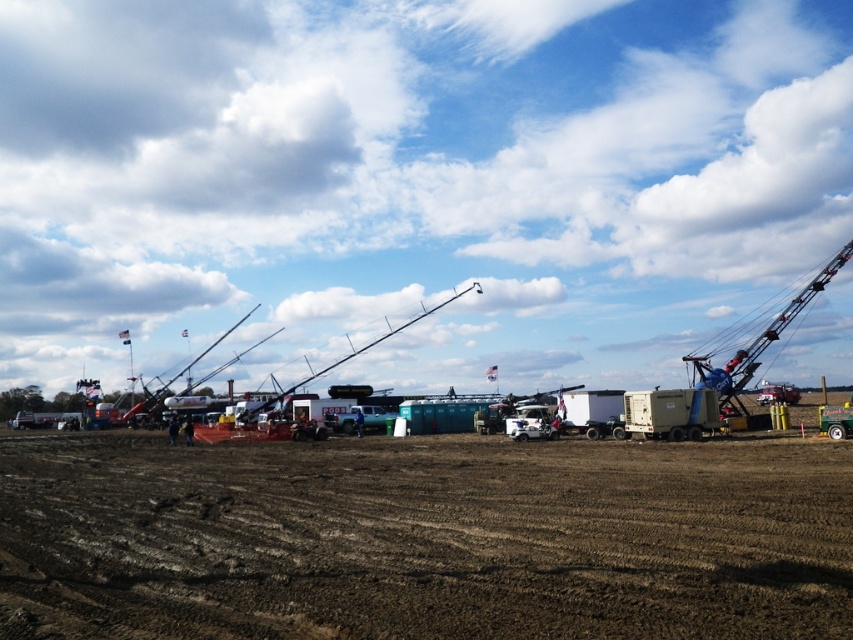
Is brown soil at center thinner than blue metallic crane at right?

Yes.

Which of these two, brown soil at center or blue metallic crane at right, stands taller?

Standing taller between the two is blue metallic crane at right.

Who is more distant from viewer, [201,452] or [723,365]?

Point [723,365]

The height and width of the screenshot is (640, 853). In order to click on brown soil at center in this screenshot , I will do `click(422, 538)`.

Can you confirm if brown soil at center is positioned below beige rubber trailer truck at center right?

Actually, brown soil at center is above beige rubber trailer truck at center right.

Which is more to the left, brown soil at center or beige rubber trailer truck at center right?

brown soil at center is more to the left.

You are a GUI agent. You are given a task and a screenshot of the screen. Output one action in this format:
    pyautogui.click(x=<x>, y=<y>)
    Task: Click on the brown soil at center
    Image resolution: width=853 pixels, height=640 pixels.
    Given the screenshot: What is the action you would take?
    pyautogui.click(x=422, y=538)

Locate an element on the screen. This screenshot has height=640, width=853. brown soil at center is located at coordinates (422, 538).

Image resolution: width=853 pixels, height=640 pixels. Identify the location of blue metallic crane at right. (756, 339).

Where is `blue metallic crane at right`? blue metallic crane at right is located at coordinates (756, 339).